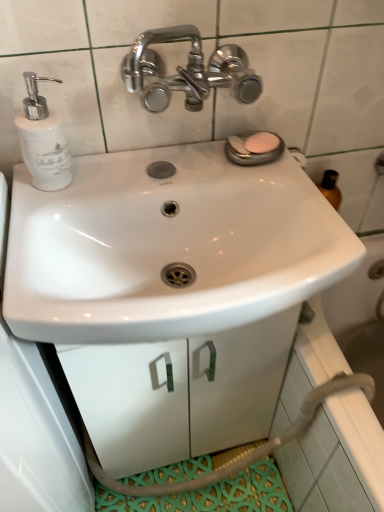
Image resolution: width=384 pixels, height=512 pixels. What do you see at coordinates (179, 392) in the screenshot?
I see `white matte cabinet at center` at bounding box center [179, 392].

The height and width of the screenshot is (512, 384). I want to click on pink matte soap at upper right, so click(x=262, y=142).

Locate an element on the screen. The image size is (384, 512). white matte cabinet at center is located at coordinates (179, 392).

Which object is positioned more to the left, pink matte soap at upper right or white glossy soap dispenser at left?

From the viewer's perspective, white glossy soap dispenser at left appears more on the left side.

Does pink matte soap at upper right turn towards white glossy soap dispenser at left?

No, pink matte soap at upper right does not turn towards white glossy soap dispenser at left.

Where is `soap located behind the white glossy soap dispenser at left`? This screenshot has height=512, width=384. soap located behind the white glossy soap dispenser at left is located at coordinates (262, 142).

Between pink matte soap at upper right and white glossy soap dispenser at left, which one has larger width?

white glossy soap dispenser at left is wider.

Can you confirm if white glossy sink at center is bigger than pink matte soap at upper right?

Yes, white glossy sink at center is bigger than pink matte soap at upper right.

Considering the positions of objects white glossy sink at center and pink matte soap at upper right in the image provided, who is more to the right, white glossy sink at center or pink matte soap at upper right?

Positioned to the right is pink matte soap at upper right.

From the image's perspective, between white glossy sink at center and pink matte soap at upper right, which one is located above?

pink matte soap at upper right.

Does white matte cabinet at center have a greater height compared to white glossy sink at center?

Correct, white matte cabinet at center is much taller as white glossy sink at center.

From the picture: From the image's perspective, is white matte cabinet at center under white glossy sink at center?

Yes, from the image's perspective, white matte cabinet at center is below white glossy sink at center.

Considering the relative positions of white matte cabinet at center and white glossy sink at center in the image provided, is white matte cabinet at center in front of white glossy sink at center?

No, it is behind white glossy sink at center.

From a real-world perspective, is white matte cabinet at center physically located above or below white glossy sink at center?

white matte cabinet at center is situated lower than white glossy sink at center in the real world.

Is white glossy soap dispenser at left facing towards pink matte soap at upper right?

No, white glossy soap dispenser at left is not oriented towards pink matte soap at upper right.

Consider the image. Are white glossy soap dispenser at left and pink matte soap at upper right making contact?

There is a gap between white glossy soap dispenser at left and pink matte soap at upper right.

Find the location of a particular element. soap located behind the white glossy soap dispenser at left is located at coordinates (262, 142).

Does white glossy soap dispenser at left have a lesser height compared to pink matte soap at upper right?

No, white glossy soap dispenser at left is not shorter than pink matte soap at upper right.

Is white glossy sink at center thinner than white matte cabinet at center?

No, white glossy sink at center is not thinner than white matte cabinet at center.

From a real-world perspective, which is physically above, white glossy sink at center or white matte cabinet at center?

white glossy sink at center.

From the image's perspective, is white glossy sink at center located above white matte cabinet at center?

Yes, from the image's perspective, white glossy sink at center is above white matte cabinet at center.

Who is bigger, white glossy sink at center or white matte cabinet at center?

white matte cabinet at center is bigger.

Is white glossy sink at center far away from white glossy soap dispenser at left?

No, white glossy sink at center is in close proximity to white glossy soap dispenser at left.

Does white glossy sink at center appear on the left side of white glossy soap dispenser at left?

No, white glossy sink at center is not to the left of white glossy soap dispenser at left.

In terms of height, does white glossy sink at center look taller or shorter compared to white glossy soap dispenser at left?

white glossy sink at center is shorter than white glossy soap dispenser at left.

Can you confirm if white glossy soap dispenser at left is positioned to the left of white matte cabinet at center?

Correct, you'll find white glossy soap dispenser at left to the left of white matte cabinet at center.

How many degrees apart are the facing directions of white glossy soap dispenser at left and white matte cabinet at center?

The angular difference between white glossy soap dispenser at left and white matte cabinet at center is 0.087 degrees.

Is white glossy soap dispenser at left further to the viewer compared to white matte cabinet at center?

No.

Does white glossy soap dispenser at left have a lesser height compared to white matte cabinet at center?

Correct, white glossy soap dispenser at left is not as tall as white matte cabinet at center.

Image resolution: width=384 pixels, height=512 pixels. Identify the location of soap located underneath the white glossy soap dispenser at left (from a real-world perspective). (262, 142).

This screenshot has height=512, width=384. Find the location of `sink in front of the pink matte soap at upper right`. sink in front of the pink matte soap at upper right is located at coordinates (171, 293).

From the image, which object appears to be nearer to white glossy sink at center, white glossy soap dispenser at left or white matte cabinet at center?

white matte cabinet at center is closer to white glossy sink at center.

When comparing their distances from white matte cabinet at center, does pink matte soap at upper right or white glossy soap dispenser at left seem closer?

white glossy soap dispenser at left is closer to white matte cabinet at center.

Looking at the image, which one is located closer to pink matte soap at upper right, white glossy sink at center or white glossy soap dispenser at left?

white glossy soap dispenser at left is closer to pink matte soap at upper right.

Which object lies nearer to the anchor point white glossy soap dispenser at left, pink matte soap at upper right or white glossy sink at center?

Among the two, pink matte soap at upper right is located nearer to white glossy soap dispenser at left.

Which object lies further to the anchor point white glossy sink at center, pink matte soap at upper right or white glossy soap dispenser at left?

Among the two, pink matte soap at upper right is located further to white glossy sink at center.

Which object lies further to the anchor point white matte cabinet at center, white glossy soap dispenser at left or pink matte soap at upper right?

pink matte soap at upper right is positioned further to the anchor white matte cabinet at center.

Estimate the real-world distances between objects in this image. Which object is closer to white matte cabinet at center, white glossy soap dispenser at left or white glossy sink at center?

white glossy sink at center is closer to white matte cabinet at center.

Estimate the real-world distances between objects in this image. Which object is closer to white matte cabinet at center, pink matte soap at upper right or white glossy sink at center?

Based on the image, white glossy sink at center appears to be nearer to white matte cabinet at center.

Locate an element on the screen. This screenshot has width=384, height=512. soap dispenser between pink matte soap at upper right and white matte cabinet at center in the vertical direction is located at coordinates (42, 139).

The image size is (384, 512). I want to click on sink that lies between pink matte soap at upper right and white matte cabinet at center from top to bottom, so click(x=171, y=293).

The image size is (384, 512). Find the location of `sink between white glossy soap dispenser at left and pink matte soap at upper right from left to right`. sink between white glossy soap dispenser at left and pink matte soap at upper right from left to right is located at coordinates (171, 293).

Locate an element on the screen. This screenshot has width=384, height=512. sink between white glossy soap dispenser at left and white matte cabinet at center in the up-down direction is located at coordinates (171, 293).